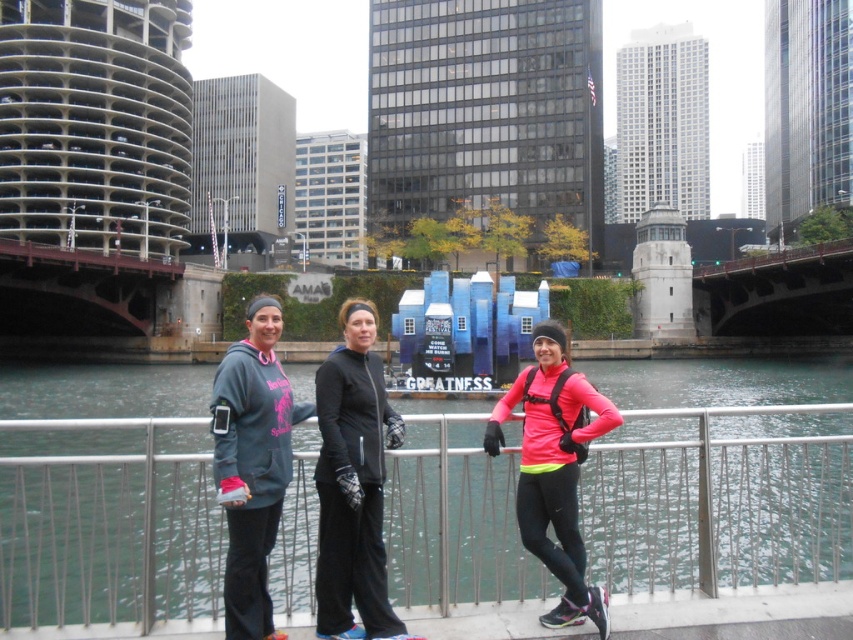
Can you confirm if gray fleece sweatshirt at center is bigger than pink matte jacket at center?

Yes.

Consider the image. Between gray fleece sweatshirt at center and pink matte jacket at center, which one appears on the left side from the viewer's perspective?

gray fleece sweatshirt at center is more to the left.

Find the location of a particular element. The height and width of the screenshot is (640, 853). gray fleece sweatshirt at center is located at coordinates (252, 465).

This screenshot has width=853, height=640. What are the coordinates of `gray fleece sweatshirt at center` in the screenshot? It's located at (252, 465).

Can you confirm if pink matte jacket at center is positioned below rusty metal bridge at left?

Correct, pink matte jacket at center is located below rusty metal bridge at left.

This screenshot has height=640, width=853. What do you see at coordinates (555, 468) in the screenshot? I see `pink matte jacket at center` at bounding box center [555, 468].

Who is more distant from viewer, (548, 557) or (161, 260)?

Positioned behind is point (161, 260).

Locate an element on the screen. pink matte jacket at center is located at coordinates (555, 468).

Can you confirm if black matte jacket at center is thinner than gray fleece sweatshirt at center?

Indeed, black matte jacket at center has a lesser width compared to gray fleece sweatshirt at center.

Is point (335, 540) in front of point (227, 518)?

Yes, point (335, 540) is in front of point (227, 518).

Where is `black matte jacket at center`? black matte jacket at center is located at coordinates (352, 483).